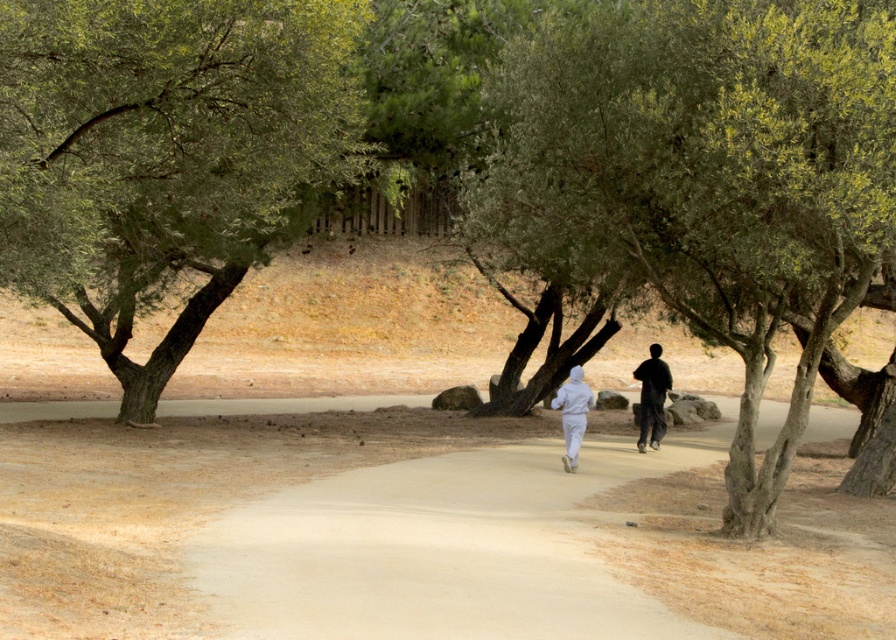
Question: Can you confirm if green leafy tree at left is positioned to the right of white matte hoodie at center?

Choices:
 (A) no
 (B) yes

Answer: (A)

Question: Based on their relative distances, which object is farther from the green leafy tree at left?

Choices:
 (A) white matte hoodie at center
 (B) dark gray hoodie at center

Answer: (B)

Question: Based on their relative distances, which object is farther from the green leafy tree at center?

Choices:
 (A) white matte running suit at center
 (B) green leafy tree at left
 (C) dark gray hoodie at center

Answer: (C)

Question: Is white matte hoodie at center to the right of dark gray hoodie at center from the viewer's perspective?

Choices:
 (A) no
 (B) yes

Answer: (A)

Question: Does light brown dirt track at center appear on the right side of dark gray hoodie at center?

Choices:
 (A) yes
 (B) no

Answer: (B)

Question: Among these points, which one is nearest to the camera?

Choices:
 (A) (138, 305)
 (B) (642, 42)

Answer: (B)